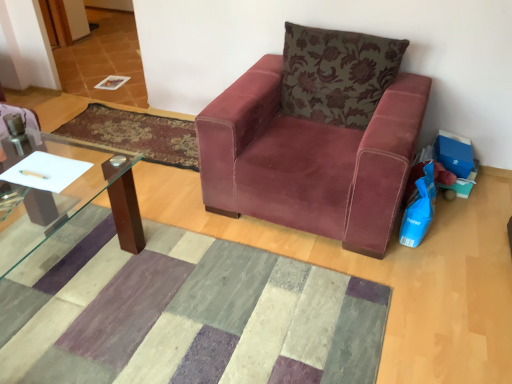
Question: Could you tell me if velvet-like burgundy mat at center, acting as the second mat starting from the front, is facing metallic silver pen at lower left?

Choices:
 (A) yes
 (B) no

Answer: (B)

Question: Does velvet-like burgundy mat at center, arranged as the first mat when viewed from the back, have a lesser width compared to metallic silver pen at lower left?

Choices:
 (A) no
 (B) yes

Answer: (A)

Question: Is velvet-like burgundy mat at center, arranged as the first mat when viewed from the back, further to the viewer compared to metallic silver pen at lower left?

Choices:
 (A) no
 (B) yes

Answer: (B)

Question: Considering the relative sizes of velvet-like burgundy mat at center, acting as the second mat starting from the front, and metallic silver pen at lower left in the image provided, is velvet-like burgundy mat at center, acting as the second mat starting from the front, taller than metallic silver pen at lower left?

Choices:
 (A) yes
 (B) no

Answer: (A)

Question: Can you confirm if velvet-like burgundy mat at center, the 2th mat ordered from the bottom, is shorter than metallic silver pen at lower left?

Choices:
 (A) no
 (B) yes

Answer: (A)

Question: In the image, is velvet maroon armchair at center positioned in front of or behind textured wool mat at center, the 2th mat viewed from the top?

Choices:
 (A) front
 (B) behind

Answer: (B)

Question: From a real-world perspective, relative to textured wool mat at center, the 2th mat viewed from the top, is velvet maroon armchair at center vertically above or below?

Choices:
 (A) below
 (B) above

Answer: (B)

Question: Does point (256, 167) appear closer or farther from the camera than point (172, 364)?

Choices:
 (A) closer
 (B) farther

Answer: (B)

Question: From the image's perspective, is velvet maroon armchair at center above or below textured wool mat at center, which is the 2th mat in back-to-front order?

Choices:
 (A) above
 (B) below

Answer: (A)

Question: Relative to velvet maroon armchair at center, is floral-patterned velvet pillow at upper right in front or behind?

Choices:
 (A) front
 (B) behind

Answer: (B)

Question: Is floral-patterned velvet pillow at upper right situated inside velvet maroon armchair at center or outside?

Choices:
 (A) inside
 (B) outside

Answer: (A)

Question: Is floral-patterned velvet pillow at upper right taller or shorter than velvet maroon armchair at center?

Choices:
 (A) short
 (B) tall

Answer: (A)

Question: Considering the positions of floral-patterned velvet pillow at upper right and velvet maroon armchair at center in the image, is floral-patterned velvet pillow at upper right bigger or smaller than velvet maroon armchair at center?

Choices:
 (A) small
 (B) big

Answer: (A)

Question: From a real-world perspective, relative to velvet-like burgundy mat at center, arranged as the first mat when viewed from the back, is textured wool mat at center, the first mat positioned from the front, vertically above or below?

Choices:
 (A) above
 (B) below

Answer: (A)

Question: Is textured wool mat at center, arranged as the first mat when ordered from the bottom, situated inside velvet-like burgundy mat at center, the 2th mat ordered from the bottom, or outside?

Choices:
 (A) outside
 (B) inside

Answer: (A)